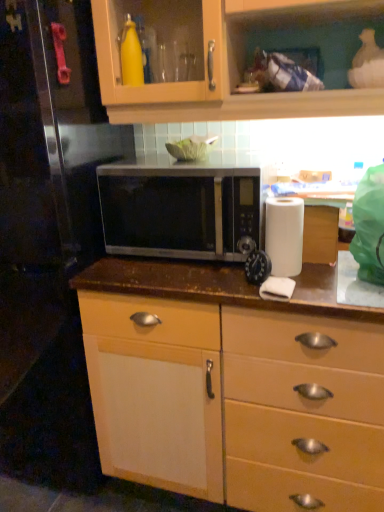
Question: Is black plastic clock at center positioned with its back to white matte paper towel at right?

Choices:
 (A) no
 (B) yes

Answer: (B)

Question: Does black plastic clock at center appear on the left side of white matte paper towel at right?

Choices:
 (A) no
 (B) yes

Answer: (B)

Question: From a real-world perspective, is black plastic clock at center located higher than white matte paper towel at right?

Choices:
 (A) yes
 (B) no

Answer: (B)

Question: Can you confirm if black plastic clock at center is thinner than white matte paper towel at right?

Choices:
 (A) no
 (B) yes

Answer: (B)

Question: Considering the relative positions of black plastic clock at center and white matte paper towel at right in the image provided, is black plastic clock at center behind white matte paper towel at right?

Choices:
 (A) yes
 (B) no

Answer: (B)

Question: Considering the positions of point (289, 239) and point (258, 364), is point (289, 239) closer or farther from the camera than point (258, 364)?

Choices:
 (A) closer
 (B) farther

Answer: (A)

Question: From the image's perspective, relative to brown polished wood countertop at center, is white matte paper towel at right above or below?

Choices:
 (A) above
 (B) below

Answer: (A)

Question: Would you say white matte paper towel at right is to the left or to the right of brown polished wood countertop at center in the picture?

Choices:
 (A) right
 (B) left

Answer: (A)

Question: Is white matte paper towel at right bigger or smaller than brown polished wood countertop at center?

Choices:
 (A) big
 (B) small

Answer: (B)

Question: Visually, is satin silver microwave at center positioned to the left or to the right of white matte paper towel at right?

Choices:
 (A) right
 (B) left

Answer: (B)

Question: In the image, is satin silver microwave at center positioned in front of or behind white matte paper towel at right?

Choices:
 (A) behind
 (B) front

Answer: (A)

Question: From a real-world perspective, is satin silver microwave at center positioned above or below white matte paper towel at right?

Choices:
 (A) below
 (B) above

Answer: (B)

Question: From their relative heights in the image, would you say satin silver microwave at center is taller or shorter than white matte paper towel at right?

Choices:
 (A) short
 (B) tall

Answer: (B)

Question: Choose the correct answer: Is brown polished wood countertop at center inside black plastic clock at center or outside it?

Choices:
 (A) outside
 (B) inside

Answer: (A)

Question: In terms of width, does brown polished wood countertop at center look wider or thinner when compared to black plastic clock at center?

Choices:
 (A) thin
 (B) wide

Answer: (B)